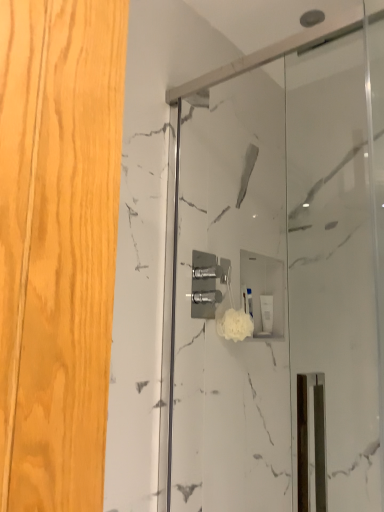
Question: Is white fluffy sponge at center looking in the opposite direction of white marble shower door at center?

Choices:
 (A) yes
 (B) no

Answer: (B)

Question: Can you confirm if white fluffy sponge at center is bigger than white marble shower door at center?

Choices:
 (A) no
 (B) yes

Answer: (A)

Question: Is white fluffy sponge at center facing towards white marble shower door at center?

Choices:
 (A) no
 (B) yes

Answer: (A)

Question: From the image's perspective, is white fluffy sponge at center on top of white marble shower door at center?

Choices:
 (A) no
 (B) yes

Answer: (A)

Question: Would you consider white fluffy sponge at center to be distant from white marble shower door at center?

Choices:
 (A) no
 (B) yes

Answer: (A)

Question: In terms of size, does white marble shower door at center appear bigger or smaller than white matte soap dispenser at center?

Choices:
 (A) big
 (B) small

Answer: (A)

Question: Relative to white matte soap dispenser at center, is white marble shower door at center in front or behind?

Choices:
 (A) front
 (B) behind

Answer: (A)

Question: Considering the positions of white marble shower door at center and white matte soap dispenser at center in the image, is white marble shower door at center wider or thinner than white matte soap dispenser at center?

Choices:
 (A) thin
 (B) wide

Answer: (A)

Question: Is white marble shower door at center inside or outside of white matte soap dispenser at center?

Choices:
 (A) inside
 (B) outside

Answer: (B)

Question: Visually, is white fluffy sponge at center positioned to the left or to the right of white matte soap dispenser at center?

Choices:
 (A) left
 (B) right

Answer: (A)

Question: From a real-world perspective, is white fluffy sponge at center physically located above or below white matte soap dispenser at center?

Choices:
 (A) below
 (B) above

Answer: (A)

Question: Considering the positions of white fluffy sponge at center and white matte soap dispenser at center in the image, is white fluffy sponge at center wider or thinner than white matte soap dispenser at center?

Choices:
 (A) wide
 (B) thin

Answer: (A)

Question: From the image's perspective, is white fluffy sponge at center above or below white matte soap dispenser at center?

Choices:
 (A) below
 (B) above

Answer: (B)

Question: Considering the positions of point (266, 304) and point (221, 330), is point (266, 304) closer or farther from the camera than point (221, 330)?

Choices:
 (A) closer
 (B) farther

Answer: (B)

Question: In terms of width, does white matte soap dispenser at center look wider or thinner when compared to white fluffy sponge at center?

Choices:
 (A) wide
 (B) thin

Answer: (B)